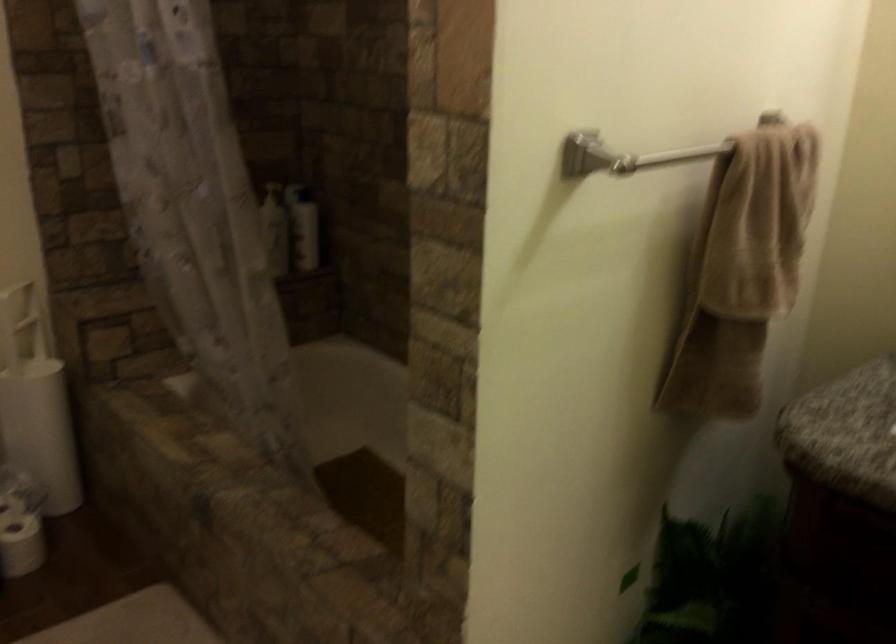
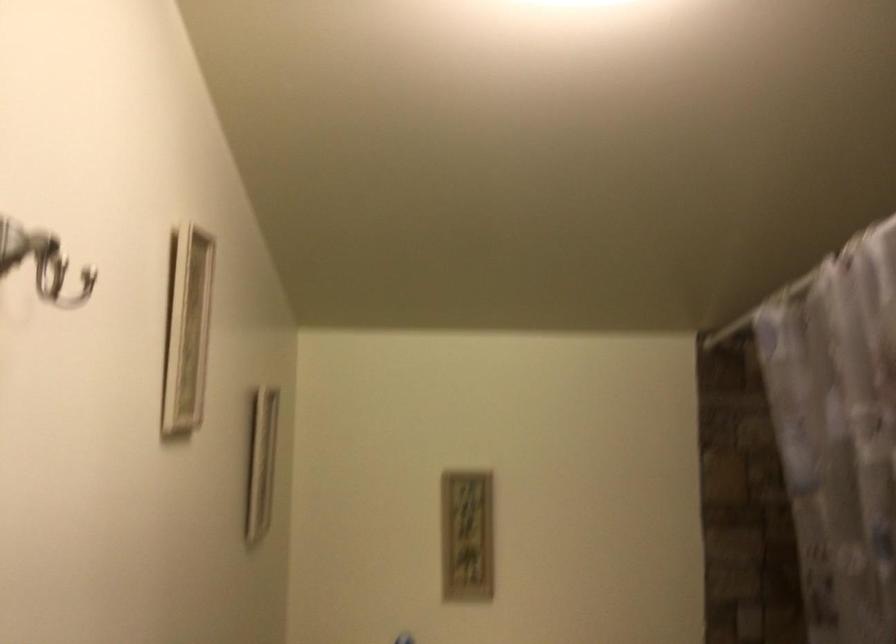
How did the camera likely rotate?

The camera's rotation is toward left-up.